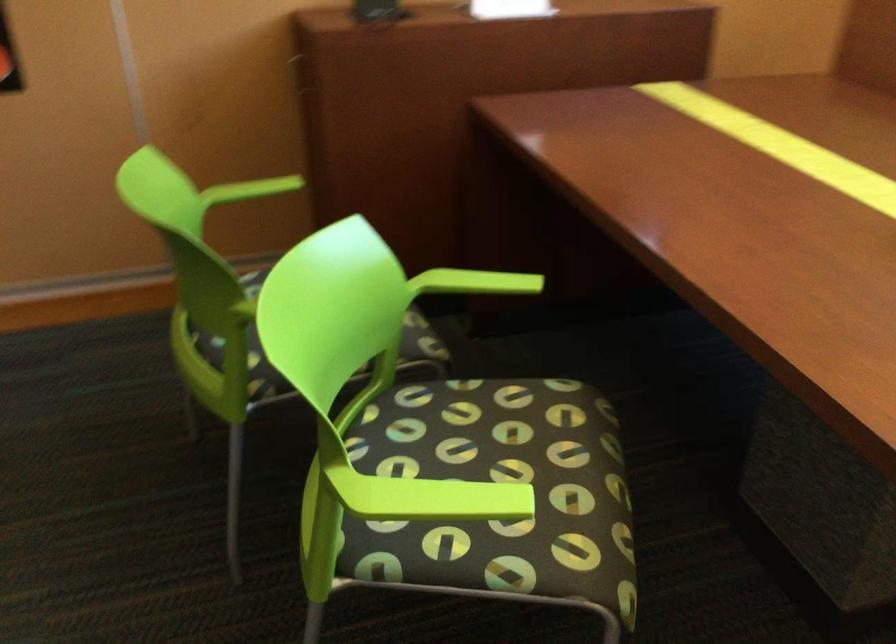
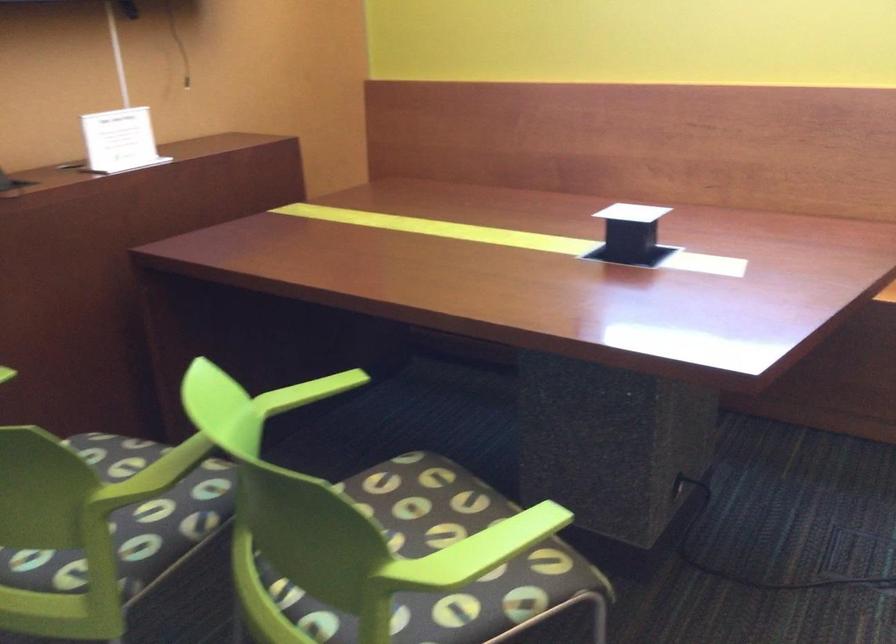
Question: The camera is either moving clockwise (left) or counter-clockwise (right) around the object. The first image is from the beginning of the video and the second image is from the end. Is the camera moving left or right when shooting the video?

Choices:
 (A) Left
 (B) Right

Answer: (A)